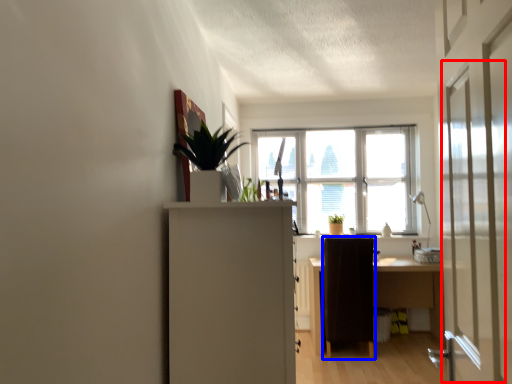
Question: Which point is closer to the camera, screen door (highlighted by a red box) or furniture (highlighted by a blue box)?

Choices:
 (A) screen door
 (B) furniture

Answer: (A)